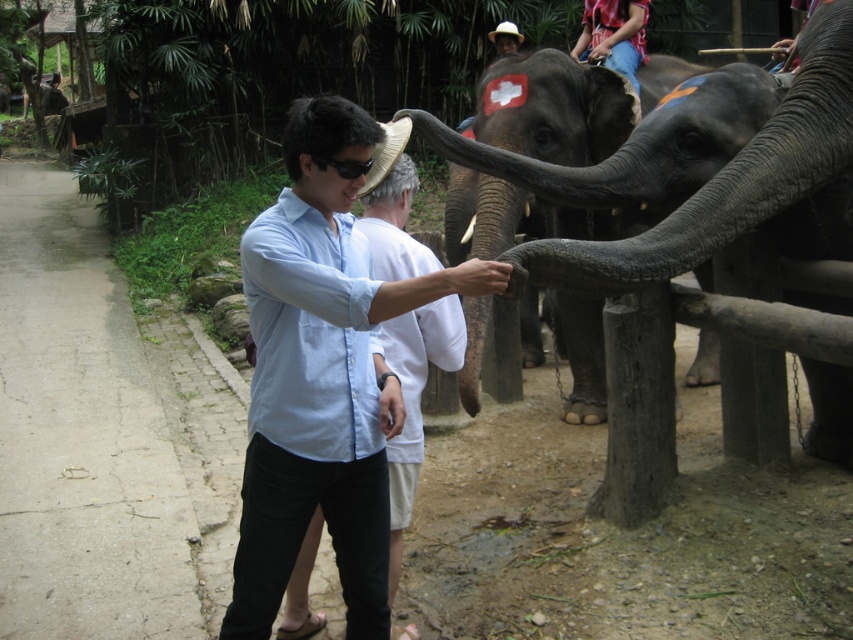
Which is above, light blue shirt at center or gray textured elephant trunk at center?

gray textured elephant trunk at center is higher up.

Between point (294, 145) and point (691, 221), which one is positioned behind?

Positioned behind is point (691, 221).

Identify the location of light blue shirt at center. The image size is (853, 640). (322, 372).